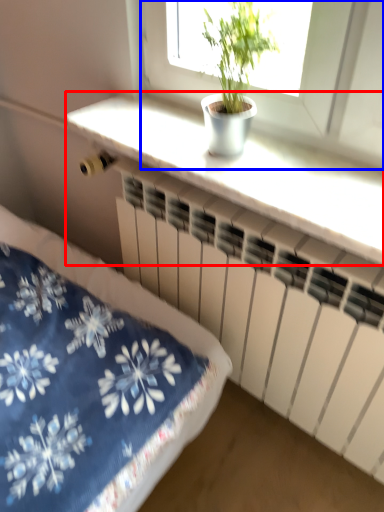
Question: Among these objects, which one is farthest to the camera, counter top (highlighted by a red box) or window (highlighted by a blue box)?

Choices:
 (A) counter top
 (B) window

Answer: (A)